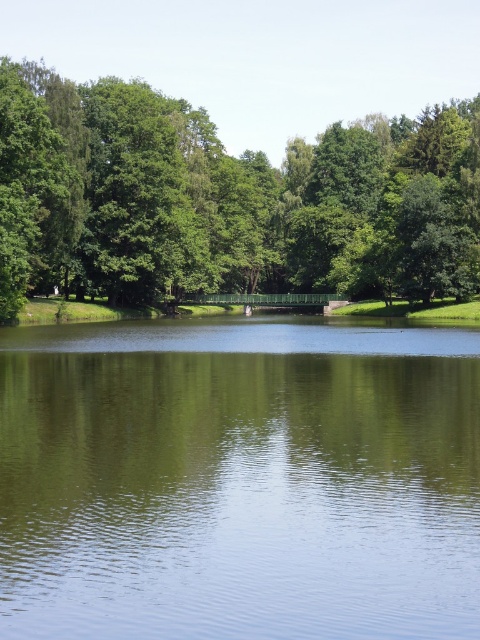
You are standing on the green bridge in the middle ground. Looking around, you see the green reflective water at center and the green leafy tree at upper left. Which object appears closer to you in terms of visual size?

The green reflective water at center appears closer because it has a smaller size compared to the green leafy tree at upper left, which is further away and thus appears smaller in reality but larger in the image due to perspective.

You are standing at the point with coordinates (240,481) in this serene natural scene. What do you see directly beneath your feet?

The point at coordinates (240,481) corresponds to green reflective water at center, so you would see the green reflective water at center directly beneath your feet.

From the picture: You are standing on the green bridge in the middle ground of the scene. Looking towards the green leafy tree at upper left, where would you see the green reflective water at center in relation to the tree?

The green reflective water at center is located below the green leafy tree at upper left, so if you are looking towards the tree, the water would appear below it in your view.